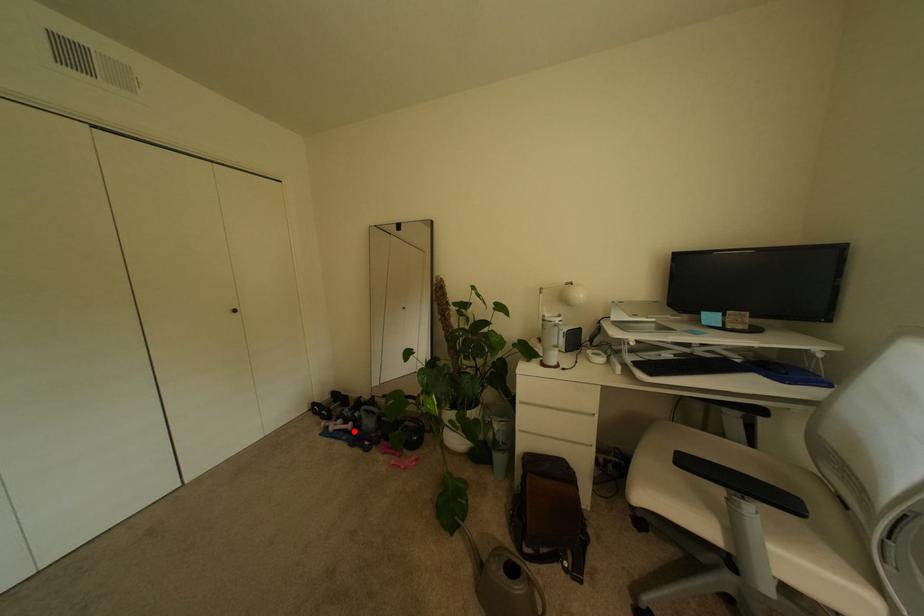
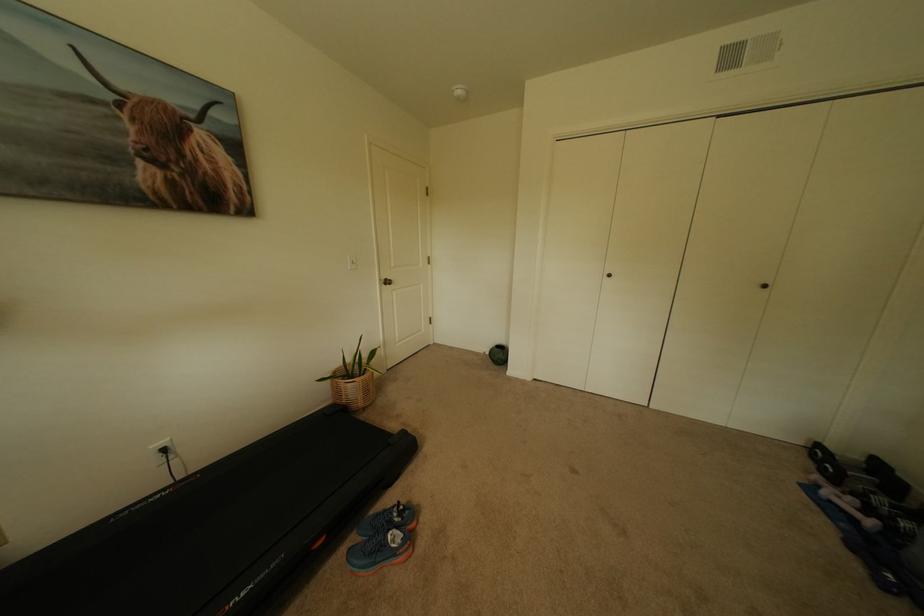
Question: I am providing you with two images of the same scene from different viewpoints. A red point is marked on the first image. Is the red point's position out of view in image 2?

Choices:
 (A) Yes
 (B) No

Answer: (B)